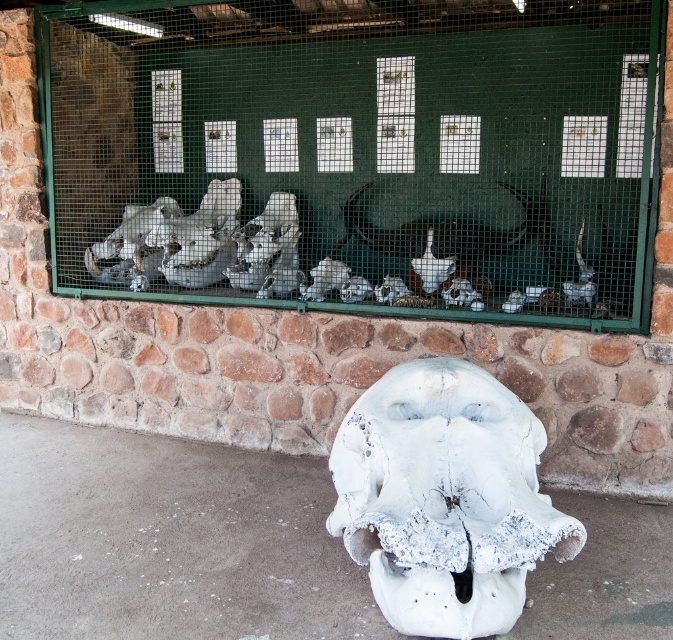
You are standing in front of the enclosure with animal skulls. You see a white matte skull at center and a white matte skull at lower center. Which one is positioned to the left?

The white matte skull at center is positioned to the left of the white matte skull at lower center.

You are a zookeeper who needs to move the white matte skull at center to the white matte skull at lower center. What is the minimum distance you need to move it?

The minimum distance you need to move the white matte skull at center to the white matte skull at lower center is 1.97 meters.